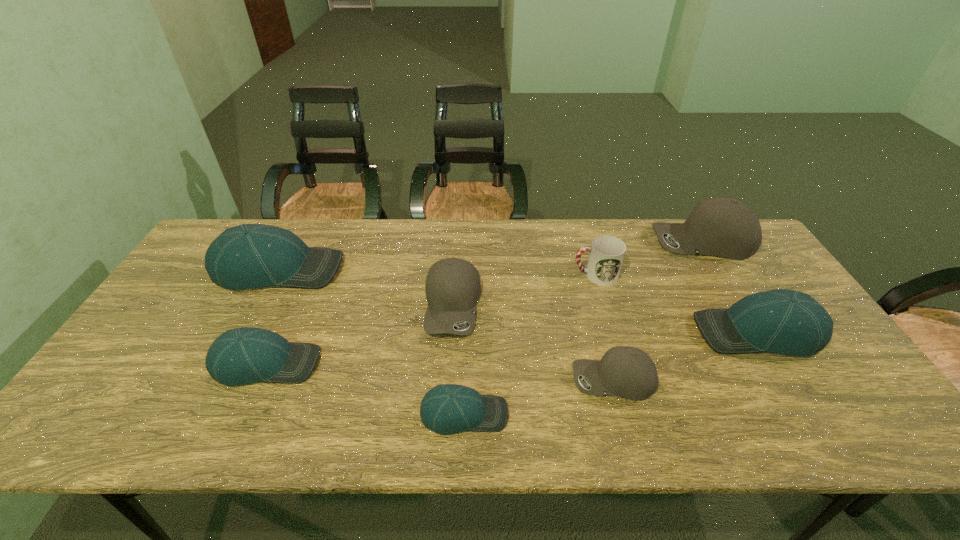
Find the location of a particular element. vacant space situated 0.240m on the handle side of the red cup is located at coordinates (493, 275).

You are a GUI agent. You are given a task and a screenshot of the screen. Output one action in this format:
    pyautogui.click(x=<x>, y=<y>)
    Task: Click on the vacant area situated 0.400m on the right of the second smallest light baseball cap
    The width and height of the screenshot is (960, 540).
    Given the screenshot: What is the action you would take?
    pyautogui.click(x=480, y=363)

Locate an element on the screen. free location located 0.300m on the front brim of the nearest gray baseball cap is located at coordinates (447, 380).

This screenshot has height=540, width=960. What are the coordinates of `vacant area situated 0.280m on the front brim of the nearest gray baseball cap` in the screenshot? It's located at (456, 380).

Identify the location of free space located on the front brim of the nearest gray baseball cap. (514, 380).

In order to click on vacant point located on the right of the nearest light baseball cap in this screenshot , I will do `click(677, 414)`.

The width and height of the screenshot is (960, 540). In order to click on object present at the near edge in this screenshot , I will do `click(448, 408)`.

Image resolution: width=960 pixels, height=540 pixels. I want to click on object located in the left edge section of the desktop, so click(x=247, y=256).

Locate an element on the screen. The image size is (960, 540). object that is at the far left corner is located at coordinates (247, 256).

Image resolution: width=960 pixels, height=540 pixels. I want to click on object that is at the far right corner, so click(724, 227).